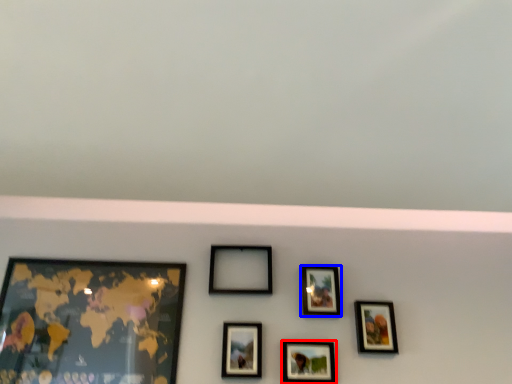
Question: Which object is further to the camera taking this photo, picture frame (highlighted by a red box) or picture frame (highlighted by a blue box)?

Choices:
 (A) picture frame
 (B) picture frame

Answer: (B)